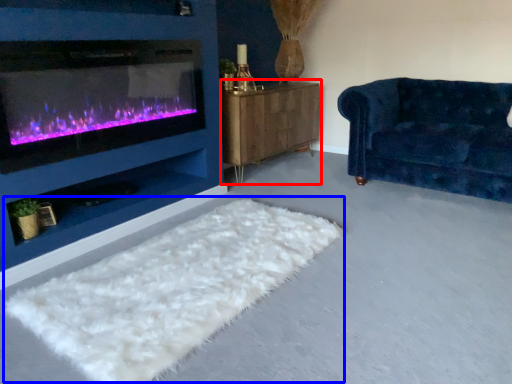
Question: Which of the following is the farthest to the observer, dresser (highlighted by a red box) or mat (highlighted by a blue box)?

Choices:
 (A) dresser
 (B) mat

Answer: (A)